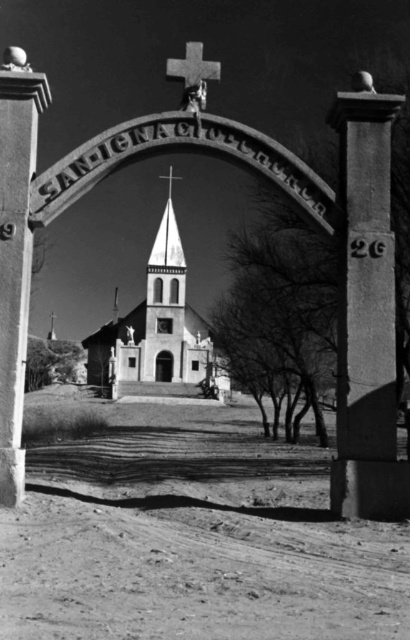
Question: Does smooth white church at center have a smaller size compared to smooth stone cross at upper center?

Choices:
 (A) no
 (B) yes

Answer: (B)

Question: Estimate the real-world distances between objects in this image. Which object is closer to the smooth white church at center?

Choices:
 (A) smooth stone cross at upper center
 (B) metallic cross at center

Answer: (B)

Question: Which of the following is the farthest from the observer?

Choices:
 (A) (193, 67)
 (B) (166, 177)

Answer: (B)

Question: Does smooth stone cross at upper center appear over metallic cross at center?

Choices:
 (A) no
 (B) yes

Answer: (B)

Question: From the image, what is the correct spatial relationship of smooth white church at center in relation to metallic cross at center?

Choices:
 (A) right
 (B) left

Answer: (B)

Question: Estimate the real-world distances between objects in this image. Which object is farther from the smooth stone cross at upper center?

Choices:
 (A) metallic cross at center
 (B) smooth white church at center

Answer: (B)